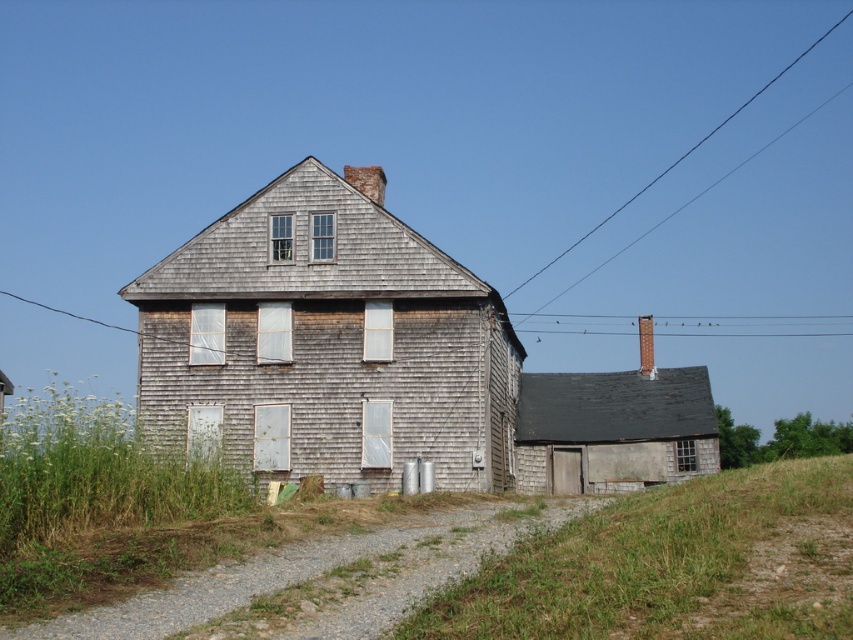
Question: Is black wire at upper right below smooth wire at upper center?

Choices:
 (A) yes
 (B) no

Answer: (B)

Question: Which point appears closest to the camera in this image?

Choices:
 (A) (698, 336)
 (B) (848, 12)

Answer: (A)

Question: Can you confirm if green grass at lower right is thinner than black wire at upper right?

Choices:
 (A) yes
 (B) no

Answer: (A)

Question: Is green grass at lower right further to camera compared to smooth wire at upper center?

Choices:
 (A) no
 (B) yes

Answer: (A)

Question: Based on their relative distances, which object is farther from the green grass at lower right?

Choices:
 (A) smooth wire at upper center
 (B) black wire at upper right

Answer: (B)

Question: Which of the following is the closest to the observer?

Choices:
 (A) (627, 634)
 (B) (764, 337)
 (C) (822, 35)

Answer: (A)